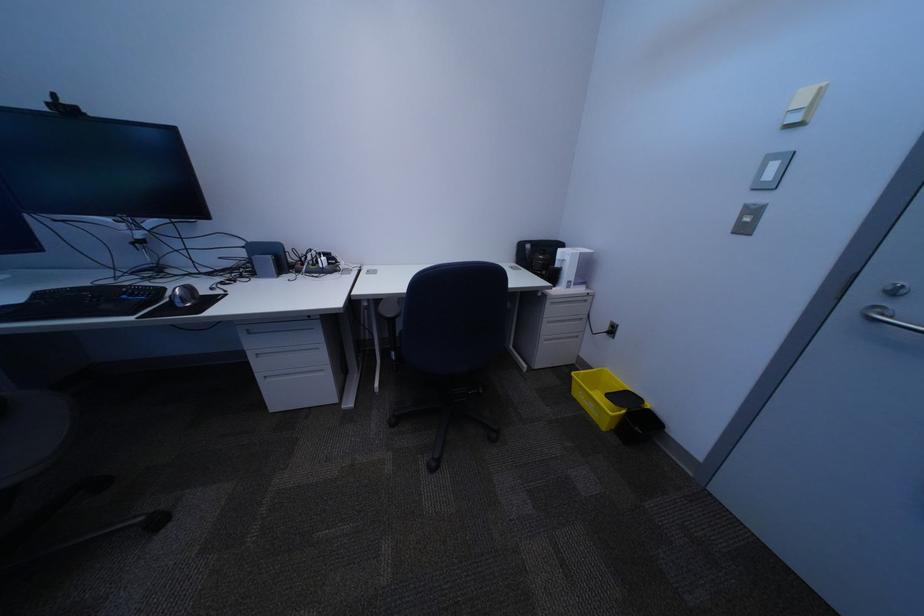
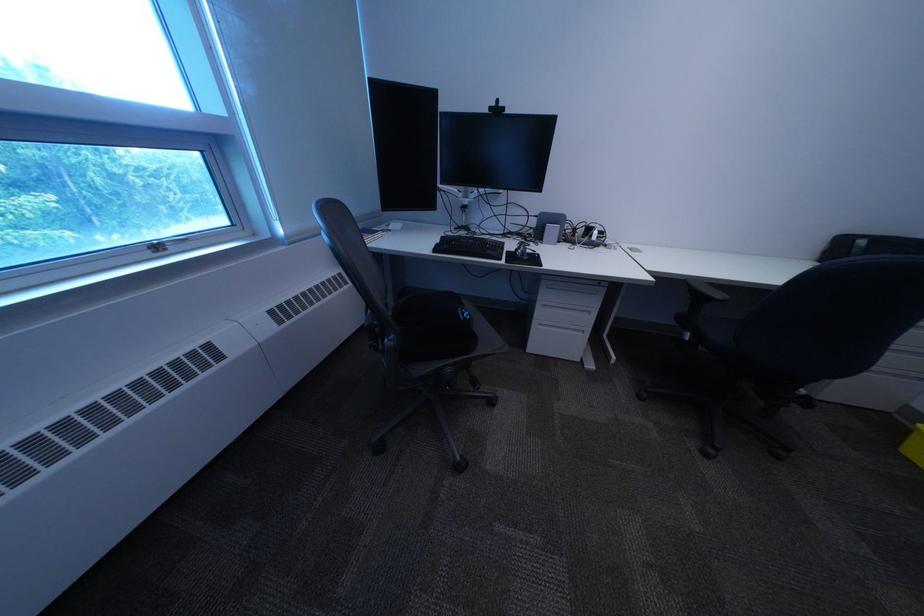
In a continuous first-person perspective shot, in which direction is the camera moving?

The cameraman walked toward left, backward.